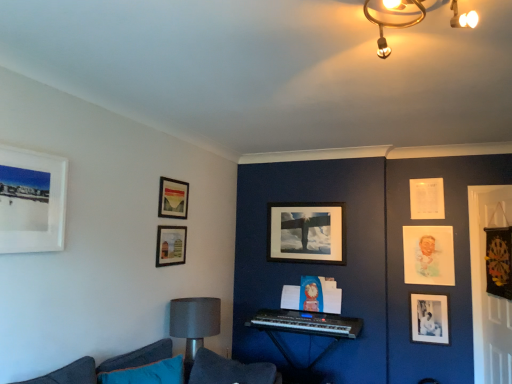
Question: Is white matte picture frame at upper left, placed as the first picture frame when sorted from front to back, facing away from matte glass picture frame at upper center, acting as the 3th picture frame starting from the front?

Choices:
 (A) yes
 (B) no

Answer: (B)

Question: Is white matte picture frame at upper left, which appears as the 8th picture frame when viewed from the right, beside matte glass picture frame at upper center, placed as the 7th picture frame when sorted from right to left?

Choices:
 (A) no
 (B) yes

Answer: (A)

Question: Is white matte picture frame at upper left, placed as the first picture frame when sorted from left to right, further to the viewer compared to matte glass picture frame at upper center, acting as the 3th picture frame starting from the front?

Choices:
 (A) no
 (B) yes

Answer: (A)

Question: Considering the relative sizes of white matte picture frame at upper left, placed as the first picture frame when sorted from front to back, and matte glass picture frame at upper center, acting as the 3th picture frame starting from the front, in the image provided, is white matte picture frame at upper left, placed as the first picture frame when sorted from front to back, smaller than matte glass picture frame at upper center, acting as the 3th picture frame starting from the front,?

Choices:
 (A) yes
 (B) no

Answer: (B)

Question: Considering the relative sizes of white matte picture frame at upper left, placed as the first picture frame when sorted from front to back, and matte glass picture frame at upper center, which appears as the sixth picture frame when viewed from the back, in the image provided, is white matte picture frame at upper left, placed as the first picture frame when sorted from front to back, thinner than matte glass picture frame at upper center, which appears as the sixth picture frame when viewed from the back,?

Choices:
 (A) yes
 (B) no

Answer: (B)

Question: Is white matte picture frame at upper left, placed as the first picture frame when sorted from left to right, oriented towards matte glass picture frame at upper center, which appears as the sixth picture frame when viewed from the back?

Choices:
 (A) yes
 (B) no

Answer: (B)

Question: From the image's perspective, is black matte photo frame at lower right, which ranks as the fifth picture frame in front-to-back order, on matte wooden picture frame at center, which is the fifth picture frame from right to left?

Choices:
 (A) no
 (B) yes

Answer: (A)

Question: Is there a large distance between black matte photo frame at lower right, which is counted as the 5th picture frame, starting from the left, and matte wooden picture frame at center, marked as the 8th picture frame in a front-to-back arrangement?

Choices:
 (A) yes
 (B) no

Answer: (A)

Question: Is black matte photo frame at lower right, which ranks as the fifth picture frame in front-to-back order, beside matte wooden picture frame at center, the 4th picture frame in the left-to-right sequence?

Choices:
 (A) no
 (B) yes

Answer: (A)

Question: From a real-world perspective, is black matte photo frame at lower right, the 4th picture frame in the right-to-left sequence, positioned over matte wooden picture frame at center, which is the fifth picture frame from right to left, based on gravity?

Choices:
 (A) no
 (B) yes

Answer: (A)

Question: Is black matte photo frame at lower right, which ranks as the fifth picture frame in front-to-back order, smaller than matte wooden picture frame at center, which is the fifth picture frame from right to left?

Choices:
 (A) no
 (B) yes

Answer: (B)

Question: Is black matte photo frame at lower right, which ranks as the fifth picture frame in front-to-back order, wider than matte wooden picture frame at center, the first picture frame from the back?

Choices:
 (A) no
 (B) yes

Answer: (A)

Question: Does velvet black dartboard at right, which is the 7th picture frame in back-to-front order, have a lesser height compared to matte wooden picture frame at center, which is the fifth picture frame from right to left?

Choices:
 (A) yes
 (B) no

Answer: (A)